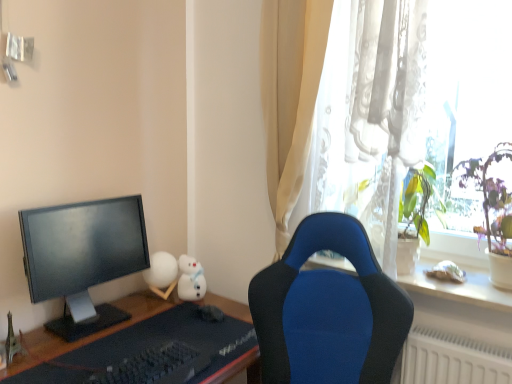
Where is `vacant space that's between matte black monitor at left and white matte sphere at center-left, positioned as the 4th toy in front-to-back order`? vacant space that's between matte black monitor at left and white matte sphere at center-left, positioned as the 4th toy in front-to-back order is located at coordinates (143, 297).